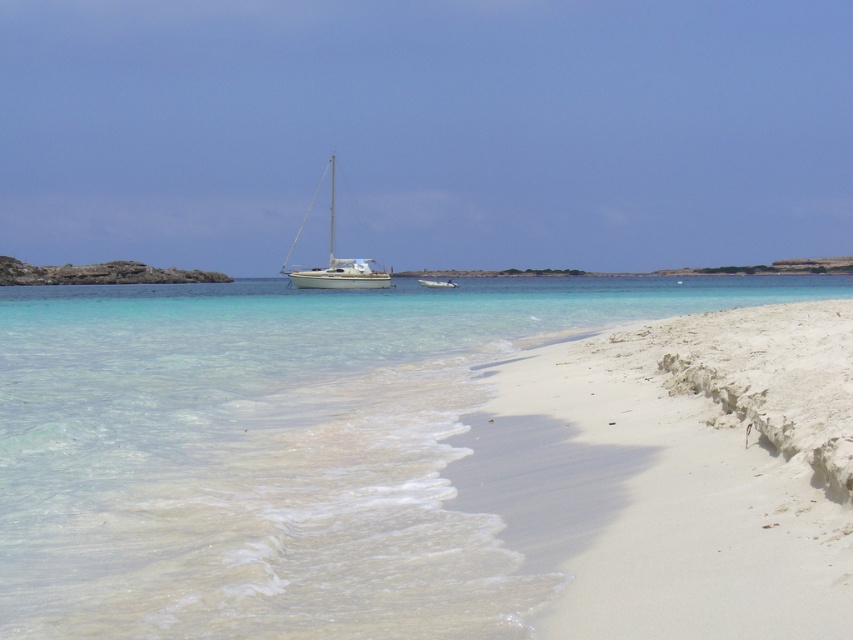
Question: Based on their relative distances, which object is nearer to the white glossy sailboat at center?

Choices:
 (A) white sandy beach at lower right
 (B) clear water at center

Answer: (B)

Question: Is clear water at center thinner than white glossy sailboat at center?

Choices:
 (A) yes
 (B) no

Answer: (B)

Question: Observing the image, what is the correct spatial positioning of white sandy beach at lower right in reference to white glossy sailboat at center?

Choices:
 (A) right
 (B) left

Answer: (A)

Question: Estimate the real-world distances between objects in this image. Which object is closer to the clear water at center?

Choices:
 (A) white glossy sailboat at center
 (B) white sandy beach at lower right

Answer: (B)

Question: Does white sandy beach at lower right lie in front of white glossy sailboat at center?

Choices:
 (A) yes
 (B) no

Answer: (A)

Question: Which point is closer to the camera?

Choices:
 (A) clear water at center
 (B) white glossy sailboat at center

Answer: (A)